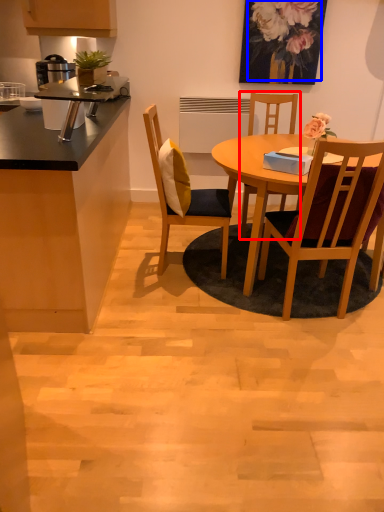
Question: Which point is closer to the camera, chair (highlighted by a red box) or floral arrangement (highlighted by a blue box)?

Choices:
 (A) chair
 (B) floral arrangement

Answer: (A)